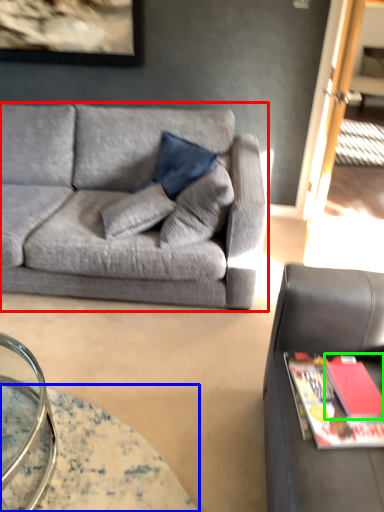
Question: Estimate the real-world distances between objects in this image. Which object is farther from studio couch (highlighted by a red box), table (highlighted by a blue box) or book (highlighted by a green box)?

Choices:
 (A) table
 (B) book

Answer: (B)